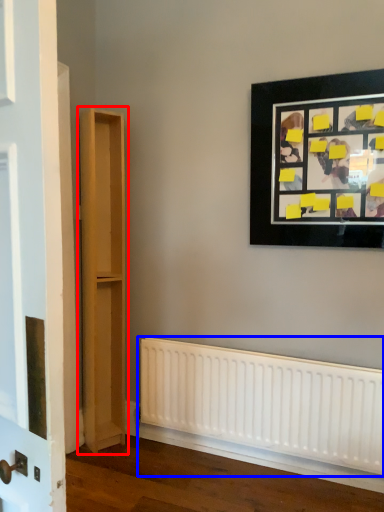
Question: Which point is closer to the camera, bookshelf (highlighted by a red box) or radiator (highlighted by a blue box)?

Choices:
 (A) bookshelf
 (B) radiator

Answer: (B)